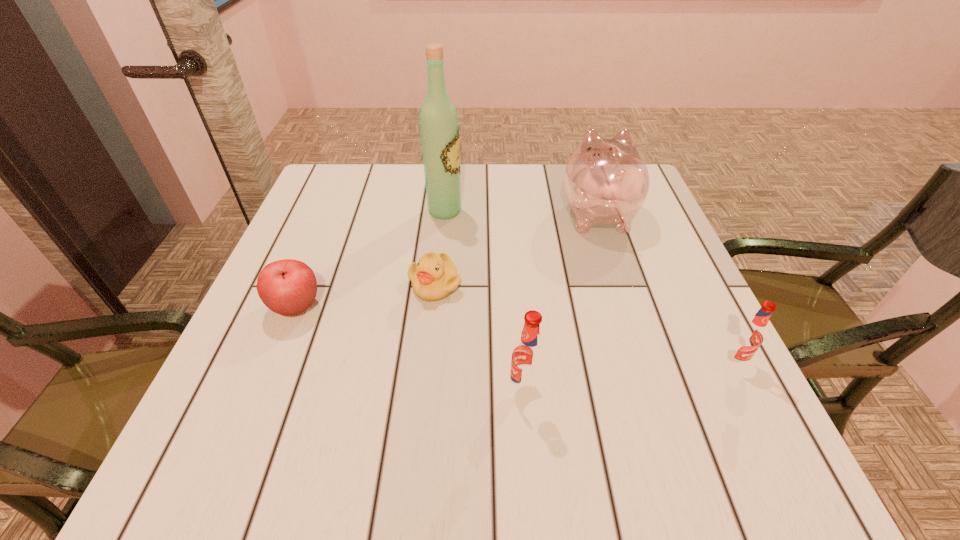
Please point a spot on the left to add another root beer. Please provide its 2D coordinates. Your answer should be formatted as a tuple, i.e. [(x, y)], where the tuple contains the x and y coordinates of a point satisfying the conditions above.

[(292, 421)]